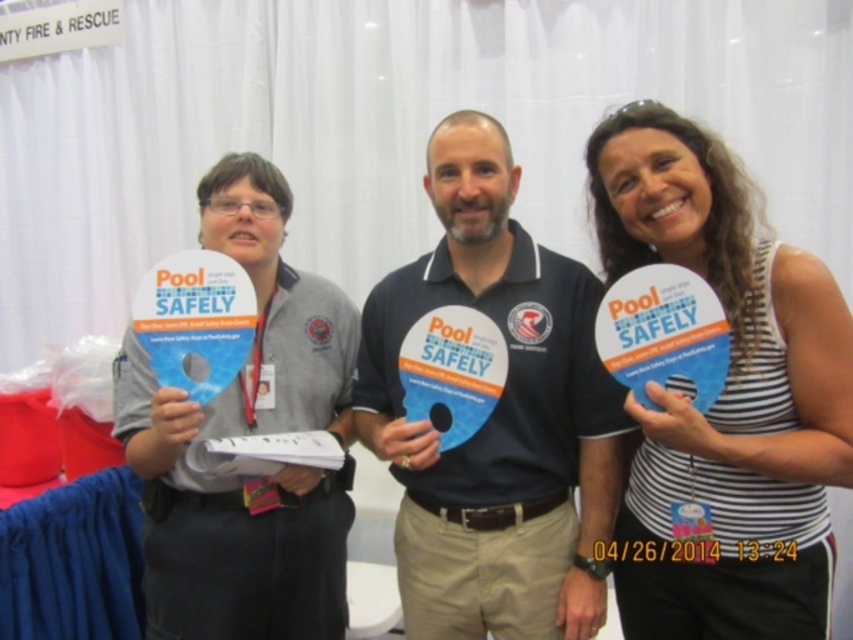
Question: Does white striped tank top at center appear on the left side of matte black polo shirt at center?

Choices:
 (A) no
 (B) yes

Answer: (A)

Question: Does white striped tank top at center have a greater width compared to matte black polo shirt at center?

Choices:
 (A) yes
 (B) no

Answer: (B)

Question: Which object is the closest to the matte gray shirt at left?

Choices:
 (A) matte black polo shirt at center
 (B) white striped tank top at center

Answer: (A)

Question: Which is farther from the matte black polo shirt at center?

Choices:
 (A) matte gray shirt at left
 (B) white striped tank top at center

Answer: (A)

Question: Is white striped tank top at center positioned before matte black polo shirt at center?

Choices:
 (A) yes
 (B) no

Answer: (A)

Question: Which object is the closest to the matte gray shirt at left?

Choices:
 (A) matte black polo shirt at center
 (B) white striped tank top at center

Answer: (A)